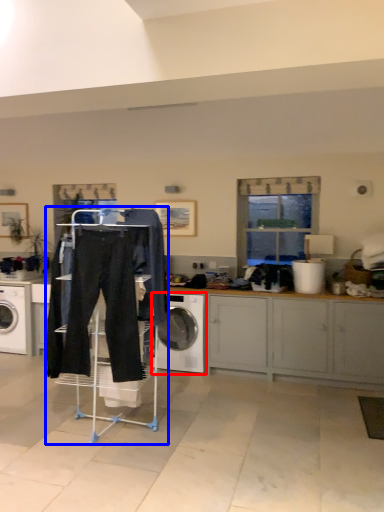
Question: Which object appears farthest to the camera in this image, washing machine (highlighted by a red box) or closet (highlighted by a blue box)?

Choices:
 (A) washing machine
 (B) closet

Answer: (A)